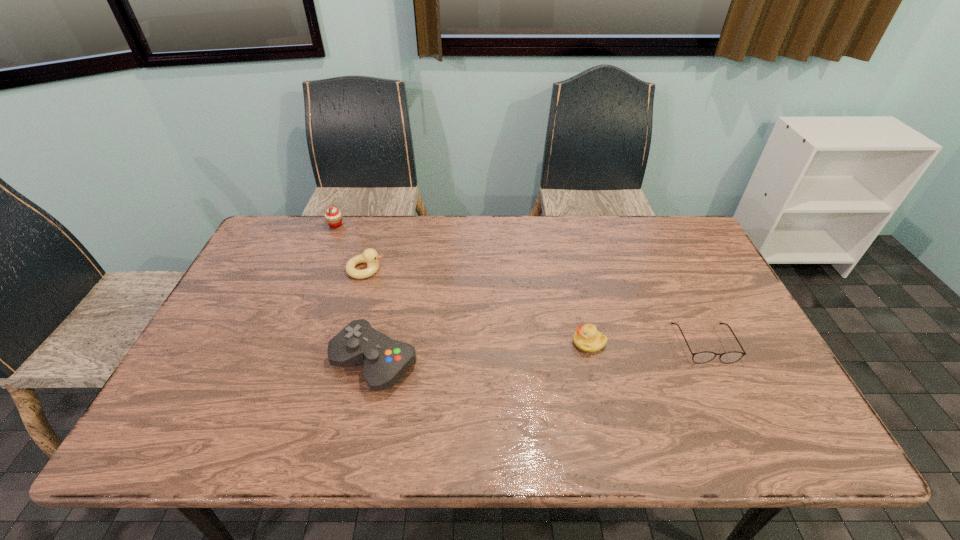
Where is `cupcake`? Image resolution: width=960 pixels, height=540 pixels. cupcake is located at coordinates (333, 217).

Identify the location of the leftmost object. (333, 217).

Where is `control`? The width and height of the screenshot is (960, 540). control is located at coordinates (385, 360).

The height and width of the screenshot is (540, 960). What are the coordinates of `the left duckling` in the screenshot? It's located at (369, 256).

Find the location of a particular element. the farther duckling is located at coordinates (369, 256).

The image size is (960, 540). In order to click on the nearer duckling in this screenshot , I will do `click(587, 338)`.

At what (x,y) coordinates should I click in order to perform the action: click on the second object from right to left. Please return your answer as a coordinate pair (x, y). Looking at the image, I should click on (587, 338).

In order to click on the shortest object in this screenshot , I will do `click(706, 356)`.

Where is `the rightmost object`? Image resolution: width=960 pixels, height=540 pixels. the rightmost object is located at coordinates (706, 356).

This screenshot has height=540, width=960. I want to click on free location located 0.260m on the right of the leftmost object, so click(x=420, y=225).